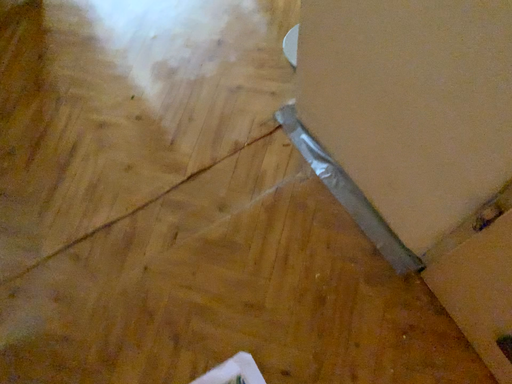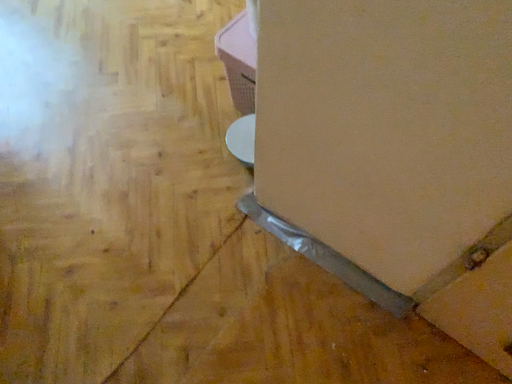
Question: Which way did the camera rotate in the video?

Choices:
 (A) rotated left
 (B) rotated right

Answer: (B)